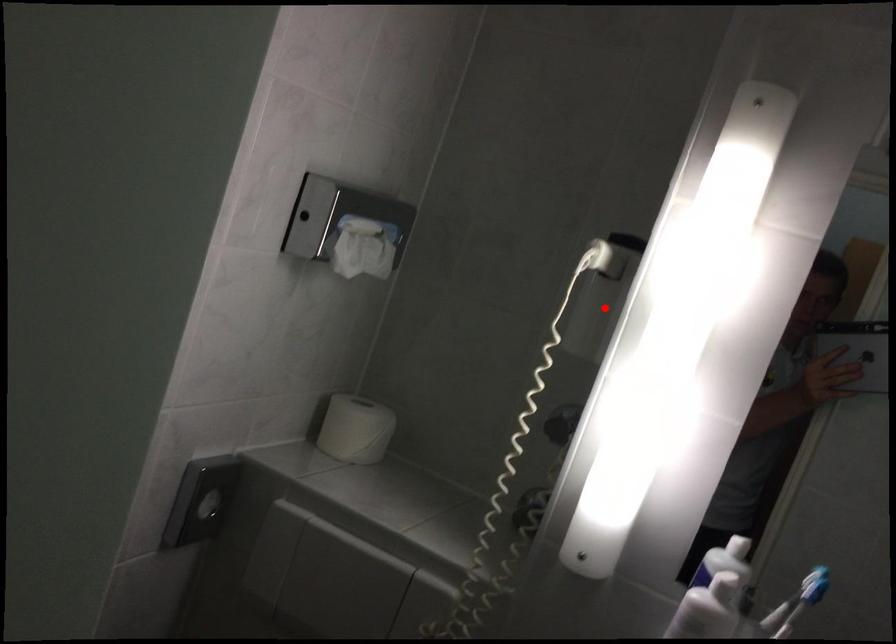
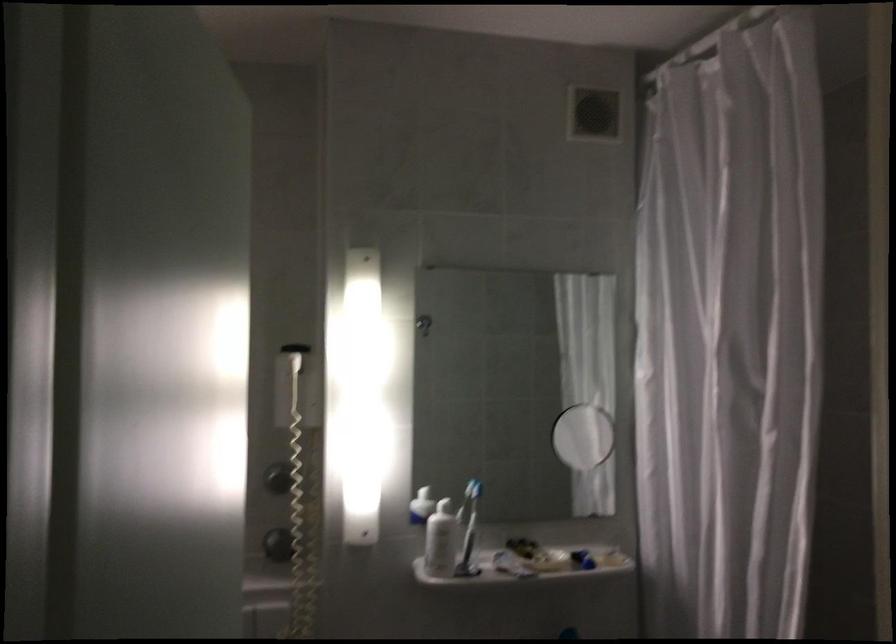
Question: I am providing you with two images of the same scene from different viewpoints. A red point is shown in image1. For the corresponding object point in image2, is it positioned nearer or farther from the camera?

Choices:
 (A) Nearer
 (B) Farther

Answer: (B)